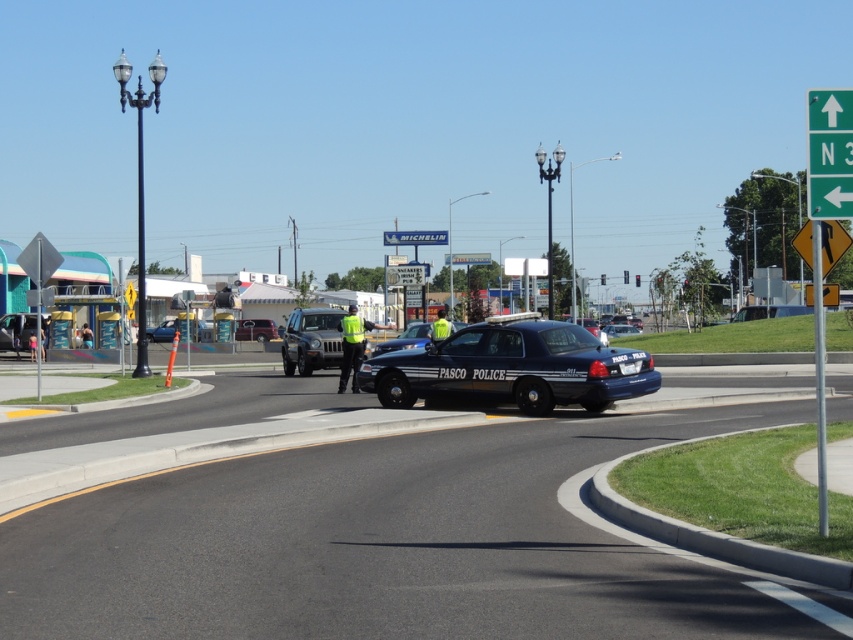
Between reflective yellow vest at center and high visibility yellow reflective vest at center, which one is positioned lower?

Positioned lower is high visibility yellow reflective vest at center.

Between reflective yellow vest at center and high visibility yellow reflective vest at center, which one appears on the left side from the viewer's perspective?

reflective yellow vest at center is more to the left.

Image resolution: width=853 pixels, height=640 pixels. What are the coordinates of `reflective yellow vest at center` in the screenshot? It's located at (352, 344).

The width and height of the screenshot is (853, 640). I want to click on matte black suv at center, so click(x=312, y=339).

Can you confirm if matte black suv at center is positioned to the left of metallic silver car at left?

Incorrect, matte black suv at center is not on the left side of metallic silver car at left.

You are a GUI agent. You are given a task and a screenshot of the screen. Output one action in this format:
    pyautogui.click(x=<x>, y=<y>)
    Task: Click on the matte black suv at center
    
    Given the screenshot: What is the action you would take?
    pyautogui.click(x=312, y=339)

Where is `matte black suv at center`? matte black suv at center is located at coordinates (312, 339).

Is matte black suv at center shorter than high visibility yellow reflective vest at center?

No.

Is point (323, 352) behind point (428, 333)?

Yes, point (323, 352) is behind point (428, 333).

Image resolution: width=853 pixels, height=640 pixels. What are the coordinates of `matte black suv at center` in the screenshot? It's located at (312, 339).